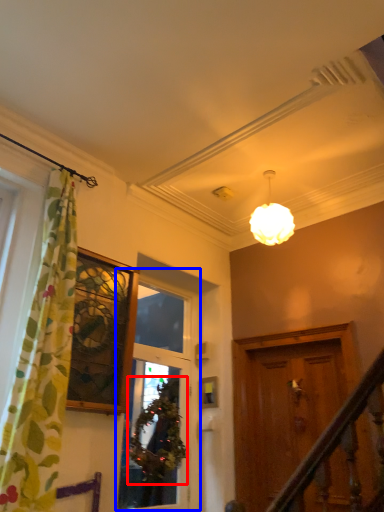
Question: Which object is further to the camera taking this photo, plant (highlighted by a red box) or window (highlighted by a blue box)?

Choices:
 (A) plant
 (B) window

Answer: (A)